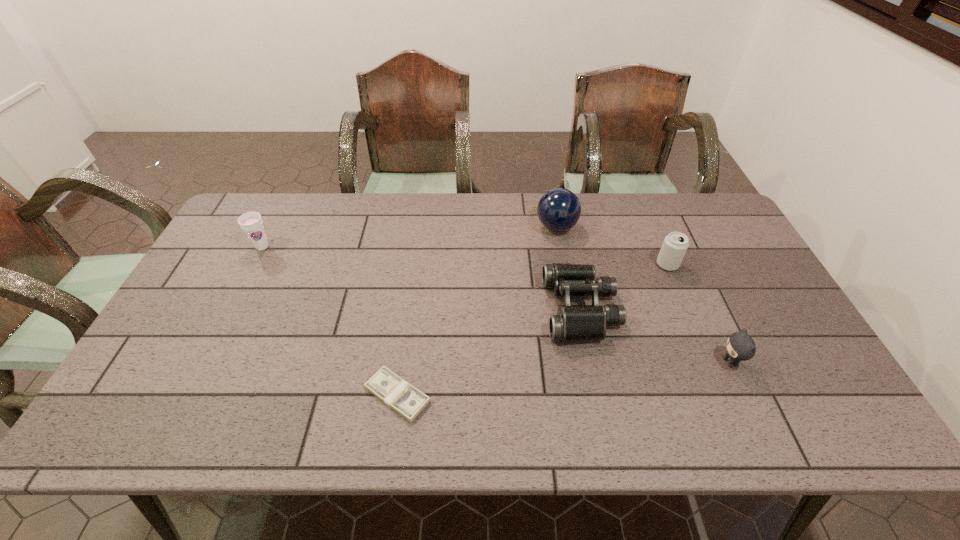
Image resolution: width=960 pixels, height=540 pixels. What are the coordinates of `object that is at the near edge` in the screenshot? It's located at (395, 392).

The image size is (960, 540). Identify the location of object located at the left edge. (251, 222).

In the image, there is a desktop. Identify the location of free space at the far edge. (293, 214).

Locate an element on the screen. The width and height of the screenshot is (960, 540). free space at the near edge of the desktop is located at coordinates (560, 417).

This screenshot has width=960, height=540. In order to click on free space at the left edge in this screenshot , I will do `click(226, 252)`.

In the image, there is a desktop. Identify the location of vacant area at the right edge. This screenshot has height=540, width=960. (739, 252).

The image size is (960, 540). Identify the location of blank space at the far right corner of the desktop. (707, 205).

Identify the location of vacant area at the near right corner of the desktop. (829, 425).

You are a GUI agent. You are given a task and a screenshot of the screen. Output one action in this format:
    pyautogui.click(x=<x>, y=<y>)
    Task: Click on the free space between the can and the leftmost object
    The image size is (960, 540).
    Given the screenshot: What is the action you would take?
    pyautogui.click(x=465, y=255)

The width and height of the screenshot is (960, 540). Find the location of `blank region between the kitten and the cup`. blank region between the kitten and the cup is located at coordinates (496, 305).